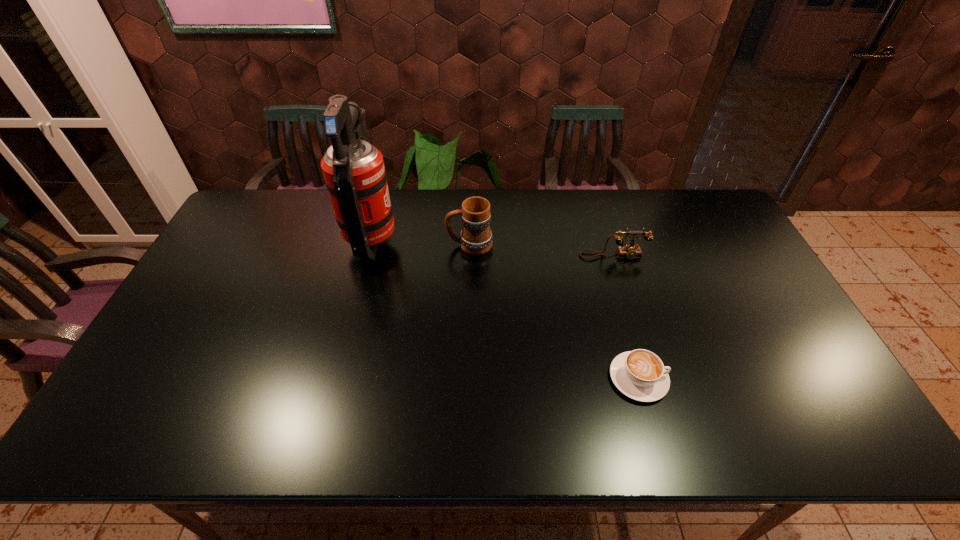
The height and width of the screenshot is (540, 960). What are the coordinates of `free space between the fire extinguisher and the mug` in the screenshot? It's located at (421, 242).

Identify the location of free space between the third shortest object and the third tallest object. Image resolution: width=960 pixels, height=540 pixels. (541, 251).

The width and height of the screenshot is (960, 540). In order to click on free space between the shortest object and the second object from left to right in this screenshot , I will do `click(554, 312)`.

Where is `unoccupied area between the second object from left to right and the fire extinguisher`? Image resolution: width=960 pixels, height=540 pixels. unoccupied area between the second object from left to right and the fire extinguisher is located at coordinates (421, 242).

The height and width of the screenshot is (540, 960). What are the coordinates of `free space between the second object from left to right and the fire extinguisher` in the screenshot? It's located at (421, 242).

Locate an element on the screen. Image resolution: width=960 pixels, height=540 pixels. free space that is in between the second shortest object and the mug is located at coordinates (541, 251).

Where is `unoccupied position between the nearest object and the fire extinguisher`? The width and height of the screenshot is (960, 540). unoccupied position between the nearest object and the fire extinguisher is located at coordinates (505, 309).

Find the location of a particular element. Image resolution: width=960 pixels, height=540 pixels. empty space that is in between the third tallest object and the nearest object is located at coordinates (626, 317).

Select which object appears as the third closest to the second shortest object. Please provide its 2D coordinates. Your answer should be formatted as a tuple, i.e. [(x, y)], where the tuple contains the x and y coordinates of a point satisfying the conditions above.

[(353, 169)]

Locate which object ranks second in proximity to the tallest object. Please provide its 2D coordinates. Your answer should be formatted as a tuple, i.e. [(x, y)], where the tuple contains the x and y coordinates of a point satisfying the conditions above.

[(630, 251)]